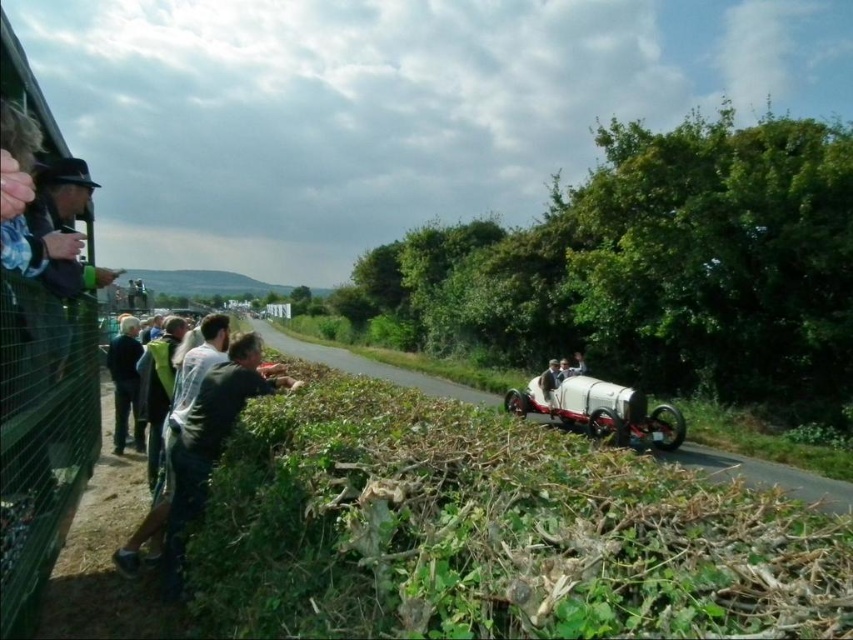
Between point (555, 362) and point (134, 369), which one is positioned in front?

Positioned in front is point (134, 369).

This screenshot has width=853, height=640. Describe the element at coordinates (596, 406) in the screenshot. I see `white matte vintage car at center-right` at that location.

Who is more distant from viewer, (561,394) or (132,376)?

The point (561,394) is more distant.

Locate an element on the screen. The image size is (853, 640). white matte vintage car at center-right is located at coordinates (596, 406).